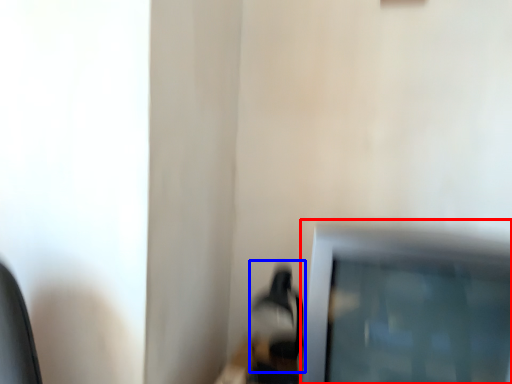
Question: Which of the following is the closest to the observer, television (highlighted by a red box) or table lamp (highlighted by a blue box)?

Choices:
 (A) television
 (B) table lamp

Answer: (A)